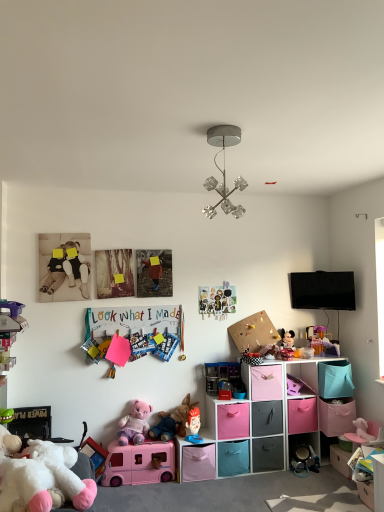
Question: From a real-world perspective, is white plush toy at lower left, the 11th toy from the back, positioned above or below translucent plastic container at upper right, which is the tenth toy from front to back?

Choices:
 (A) below
 (B) above

Answer: (A)

Question: Considering their positions, is white plush toy at lower left, the 11th toy from the back, located in front of or behind translucent plastic container at upper right, which is the tenth toy from front to back?

Choices:
 (A) behind
 (B) front

Answer: (B)

Question: Based on their relative distances, which object is farther from the pink plush elephant at lower right, positioned as the 10th toy in back-to-front order?

Choices:
 (A) pink fabric drawer at lower center, positioned as the third drawer in bottom-to-top order
 (B) pink fabric storage box at lower center, arranged as the 3th storage box when viewed from the right
 (C) white plush toy at lower left, the 11th toy from the back
 (D) plush pink fabric teddy bear at lower center, marked as the 4th toy in a front-to-back arrangement
 (E) translucent plastic container at upper right, the second toy viewed from the back

Answer: (C)

Question: Which is farther from the matte gray drawer at center, the 6th drawer viewed from the top?

Choices:
 (A) pink fabric drawer at center, arranged as the 5th drawer when ordered from the bottom
 (B) multicolored paper at upper center, which appears as the seventh toy when viewed from the front
 (C) matte paper collage at center, acting as the eleventh toy starting from the front
 (D) blue plastic toy at center, the fourth toy from the back
 (E) plush fabric figurine at center, the seventh toy positioned from the back

Answer: (B)